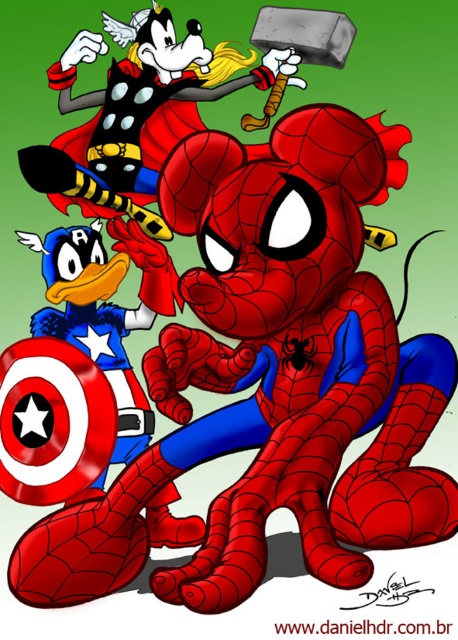
Question: Can you confirm if shiny metallic hammer at upper center is positioned to the left of shiny metallic shield at lower left?

Choices:
 (A) yes
 (B) no

Answer: (B)

Question: Where is shiny metallic hammer at upper center located in relation to shiny metallic shield at lower left in the image?

Choices:
 (A) above
 (B) below

Answer: (A)

Question: Is the position of shiny metallic hammer at upper center more distant than that of shiny metallic shield at lower left?

Choices:
 (A) yes
 (B) no

Answer: (A)

Question: Which point is closer to the camera taking this photo?

Choices:
 (A) (152, 38)
 (B) (86, 262)

Answer: (B)

Question: Which point appears farthest from the camera in this image?

Choices:
 (A) tap(164, 538)
 (B) tap(157, 26)

Answer: (B)